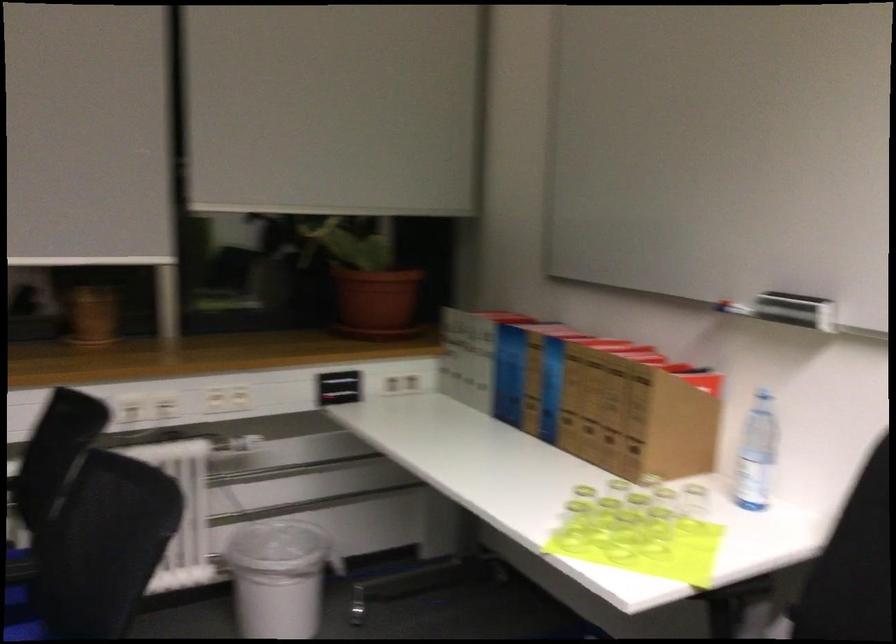
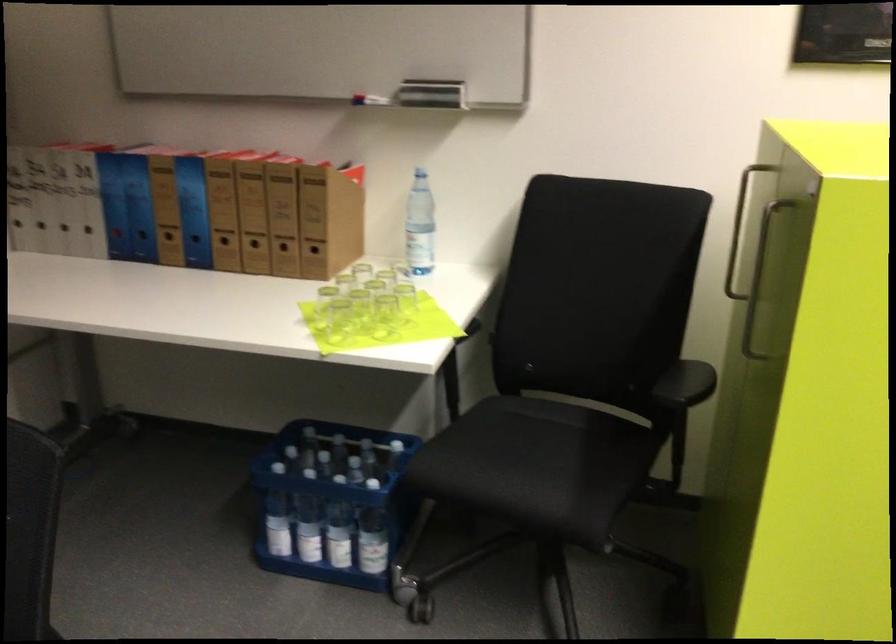
Where in the second image is the point corresponding to (685,529) from the first image?

(405, 299)